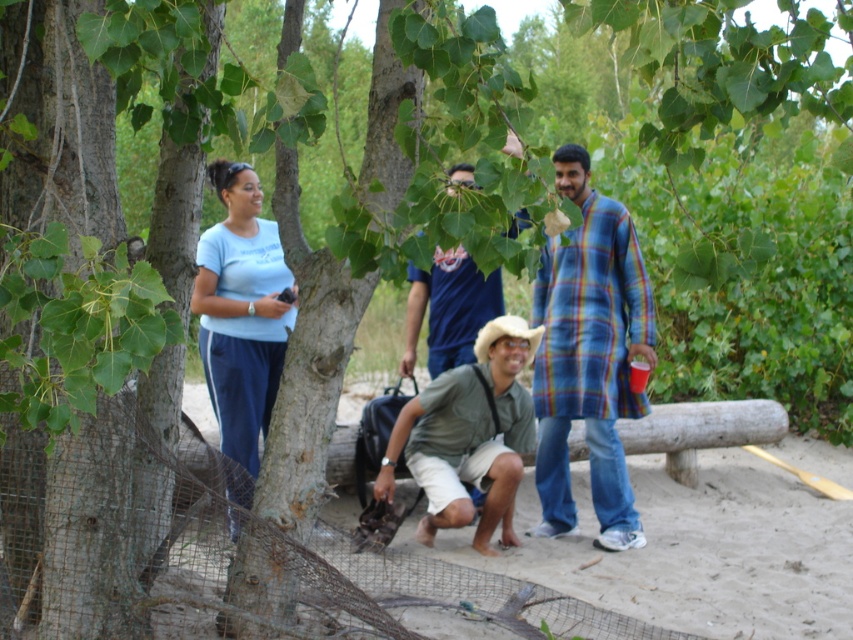
Question: Which object is the closest to the plaid cotton shirt at right?

Choices:
 (A) wooden log at center
 (B) green matte shirt at center
 (C) light blue t-shirt at center

Answer: (B)

Question: In this image, where is plaid cotton shirt at right located relative to blue cotton shirt at center?

Choices:
 (A) left
 (B) right

Answer: (B)

Question: Does plaid cotton shirt at right appear on the left side of light blue t-shirt at center?

Choices:
 (A) no
 (B) yes

Answer: (A)

Question: Among these points, which one is nearest to the camera?

Choices:
 (A) tap(598, 513)
 (B) tap(422, 536)

Answer: (B)

Question: Is the position of light blue t-shirt at center less distant than that of blue cotton shirt at center?

Choices:
 (A) yes
 (B) no

Answer: (A)

Question: Which point is farther to the camera?

Choices:
 (A) wooden log at center
 (B) green matte shirt at center
 (C) blue cotton shirt at center
 (D) light blue t-shirt at center

Answer: (A)